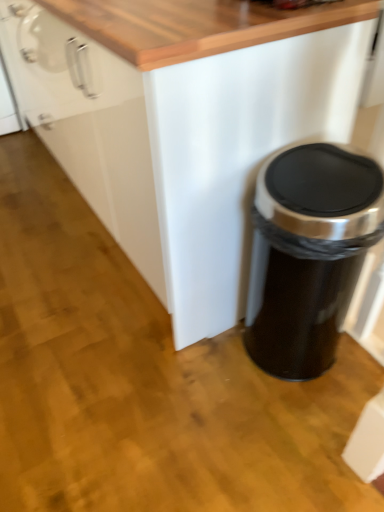
This screenshot has width=384, height=512. In order to click on white matte cabinet at center in this screenshot , I will do `click(182, 140)`.

This screenshot has width=384, height=512. What do you see at coordinates (182, 140) in the screenshot?
I see `white matte cabinet at center` at bounding box center [182, 140].

Where is `black matte trash can at lower right`? black matte trash can at lower right is located at coordinates (308, 254).

Measure the distance between black matte trash can at lower right and camera.

They are 35.39 inches apart.

Describe the element at coordinates (308, 254) in the screenshot. I see `black matte trash can at lower right` at that location.

You are a GUI agent. You are given a task and a screenshot of the screen. Output one action in this format:
    pyautogui.click(x=<x>, y=<y>)
    Task: Click on the white matte cabinet at center
    
    Given the screenshot: What is the action you would take?
    pyautogui.click(x=182, y=140)

Is white matte cabinet at center to the left of black matte trash can at lower right from the viewer's perspective?

Indeed, white matte cabinet at center is positioned on the left side of black matte trash can at lower right.

Is the depth of white matte cabinet at center less than that of black matte trash can at lower right?

Yes, it is.

Which is nearer, (48, 25) or (318, 177)?

Point (48, 25) is farther from the camera than point (318, 177).

From the image's perspective, is white matte cabinet at center over black matte trash can at lower right?

Yes, from the image's perspective, white matte cabinet at center is over black matte trash can at lower right.

From a real-world perspective, is white matte cabinet at center positioned above or below black matte trash can at lower right?

white matte cabinet at center is above black matte trash can at lower right.

Considering the sizes of white matte cabinet at center and black matte trash can at lower right in the image, is white matte cabinet at center wider or thinner than black matte trash can at lower right?

Considering their sizes, white matte cabinet at center looks broader than black matte trash can at lower right.

Consider the image. Considering the sizes of objects white matte cabinet at center and black matte trash can at lower right in the image provided, who is shorter, white matte cabinet at center or black matte trash can at lower right?

black matte trash can at lower right.

Between white matte cabinet at center and black matte trash can at lower right, which one has smaller size?

Smaller between the two is black matte trash can at lower right.

Is white matte cabinet at center not within black matte trash can at lower right?

Yes, white matte cabinet at center is not within black matte trash can at lower right.

Is white matte cabinet at center not close to black matte trash can at lower right?

No, white matte cabinet at center is not far away from black matte trash can at lower right.

Does white matte cabinet at center turn towards black matte trash can at lower right?

No, white matte cabinet at center is not facing towards black matte trash can at lower right.

Can you tell me how much white matte cabinet at center and black matte trash can at lower right differ in facing direction?

white matte cabinet at center and black matte trash can at lower right are facing 0.0374 degrees away from each other.

The image size is (384, 512). I want to click on waste container below the white matte cabinet at center (from the image's perspective), so click(x=308, y=254).

Considering the positions of objects black matte trash can at lower right and white matte cabinet at center in the image provided, who is more to the right, black matte trash can at lower right or white matte cabinet at center?

black matte trash can at lower right is more to the right.

Considering their positions, is black matte trash can at lower right located in front of or behind white matte cabinet at center?

In the image, black matte trash can at lower right appears behind white matte cabinet at center.

Between point (282, 243) and point (27, 65), which one is positioned in front?

The point (282, 243) is closer to the camera.

From the image's perspective, relative to white matte cabinet at center, is black matte trash can at lower right above or below?

black matte trash can at lower right is below white matte cabinet at center.

From the picture: From a real-world perspective, is black matte trash can at lower right under white matte cabinet at center?

Yes, from a real-world perspective, black matte trash can at lower right is beneath white matte cabinet at center.

Which of these two, black matte trash can at lower right or white matte cabinet at center, is wider?

white matte cabinet at center.

Can you confirm if black matte trash can at lower right is taller than white matte cabinet at center?

No, black matte trash can at lower right is not taller than white matte cabinet at center.

Considering the sizes of black matte trash can at lower right and white matte cabinet at center in the image, is black matte trash can at lower right bigger or smaller than white matte cabinet at center?

black matte trash can at lower right is smaller than white matte cabinet at center.

Would you say black matte trash can at lower right is inside or outside white matte cabinet at center?

black matte trash can at lower right exists outside the volume of white matte cabinet at center.

In the scene shown: Is black matte trash can at lower right in contact with white matte cabinet at center?

No, black matte trash can at lower right is not beside white matte cabinet at center.

Looking at this image, is black matte trash can at lower right oriented towards white matte cabinet at center?

No, black matte trash can at lower right does not turn towards white matte cabinet at center.

How different are the orientations of black matte trash can at lower right and white matte cabinet at center in degrees?

There is a 0.0374-degree angle between the facing directions of black matte trash can at lower right and white matte cabinet at center.

Measure the distance from black matte trash can at lower right to white matte cabinet at center.

black matte trash can at lower right is 15.32 inches away from white matte cabinet at center.

The width and height of the screenshot is (384, 512). In order to click on cabinetry above the black matte trash can at lower right (from the image's perspective) in this screenshot , I will do `click(182, 140)`.

This screenshot has width=384, height=512. Identify the location of waste container below the white matte cabinet at center (from the image's perspective). (308, 254).

The height and width of the screenshot is (512, 384). I want to click on waste container lying behind the white matte cabinet at center, so pyautogui.click(x=308, y=254).